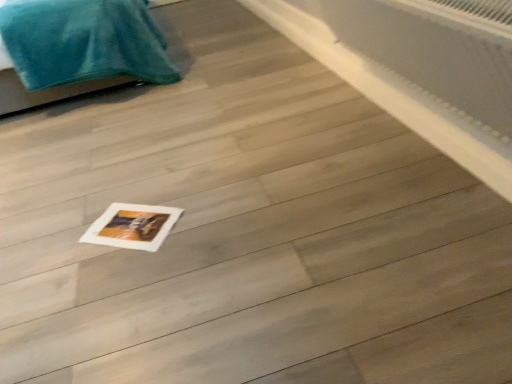
Locate an element on the screen. spots to the right of white glossy magazine at center is located at coordinates (198, 215).